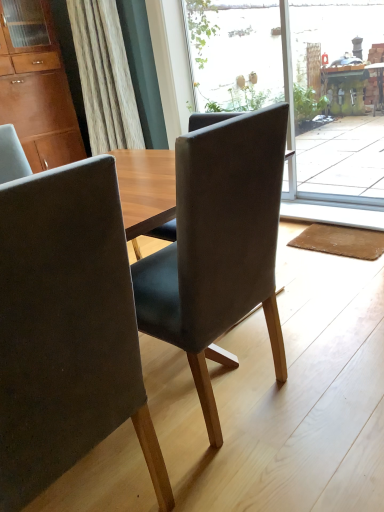
Question: Is transparent glass screen door at upper right far from transparent glass door at center?

Choices:
 (A) yes
 (B) no

Answer: (B)

Question: Considering the relative sizes of transparent glass screen door at upper right and transparent glass door at center in the image provided, is transparent glass screen door at upper right thinner than transparent glass door at center?

Choices:
 (A) yes
 (B) no

Answer: (B)

Question: From the image's perspective, does transparent glass screen door at upper right appear higher than transparent glass door at center?

Choices:
 (A) yes
 (B) no

Answer: (B)

Question: Can you confirm if transparent glass screen door at upper right is wider than transparent glass door at center?

Choices:
 (A) yes
 (B) no

Answer: (A)

Question: Is transparent glass screen door at upper right looking in the opposite direction of transparent glass door at center?

Choices:
 (A) yes
 (B) no

Answer: (B)

Question: From the image's perspective, relative to brown fabric mat at lower right, is transparent glass screen door at upper right above or below?

Choices:
 (A) above
 (B) below

Answer: (A)

Question: Choose the correct answer: Is transparent glass screen door at upper right inside brown fabric mat at lower right or outside it?

Choices:
 (A) inside
 (B) outside

Answer: (B)

Question: Is transparent glass screen door at upper right taller or shorter than brown fabric mat at lower right?

Choices:
 (A) tall
 (B) short

Answer: (A)

Question: Is transparent glass screen door at upper right to the left or to the right of brown fabric mat at lower right in the image?

Choices:
 (A) left
 (B) right

Answer: (B)

Question: Is point (365, 6) positioned closer to the camera than point (69, 234)?

Choices:
 (A) farther
 (B) closer

Answer: (A)

Question: Visually, is transparent glass door at center positioned to the left or to the right of matte gray chair at center, the first chair viewed from the left?

Choices:
 (A) left
 (B) right

Answer: (B)

Question: Is transparent glass door at center inside the boundaries of matte gray chair at center, the first chair viewed from the left, or outside?

Choices:
 (A) inside
 (B) outside

Answer: (B)

Question: Looking at the image, does transparent glass door at center seem bigger or smaller compared to matte gray chair at center, which is counted as the 2th chair, starting from the right?

Choices:
 (A) small
 (B) big

Answer: (A)

Question: From the image's perspective, relative to matte brown cabinet at upper left, is brown fabric mat at lower right above or below?

Choices:
 (A) below
 (B) above

Answer: (A)

Question: Does point (329, 225) appear closer or farther from the camera than point (6, 25)?

Choices:
 (A) farther
 (B) closer

Answer: (B)